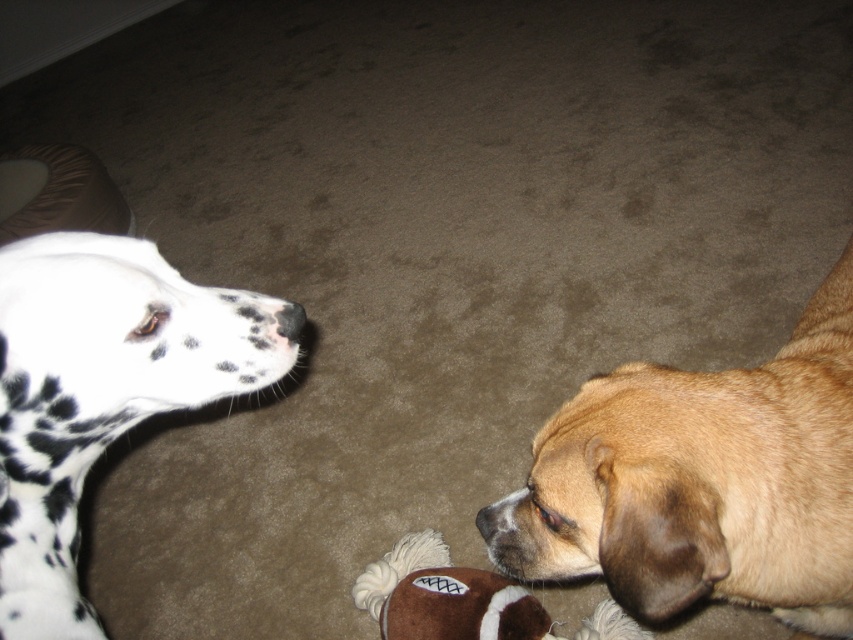
Question: Can you confirm if brown furry dog at lower right is positioned below black matte nose at upper left?

Choices:
 (A) no
 (B) yes

Answer: (B)

Question: Which point is farther to the camera?

Choices:
 (A) black matte nose at upper left
 (B) spotted fur dog at left
 (C) brown fuzzy nose at lower center

Answer: (C)

Question: Which of the following is the closest to the observer?

Choices:
 (A) (277, 323)
 (B) (39, 259)

Answer: (B)

Question: Is spotted fur dog at left positioned in front of black matte nose at upper left?

Choices:
 (A) no
 (B) yes

Answer: (B)

Question: Is brown furry dog at lower right positioned behind black matte nose at upper left?

Choices:
 (A) yes
 (B) no

Answer: (B)

Question: Among these points, which one is farthest from the camera?

Choices:
 (A) (548, 540)
 (B) (489, 515)
 (C) (224, 321)

Answer: (B)